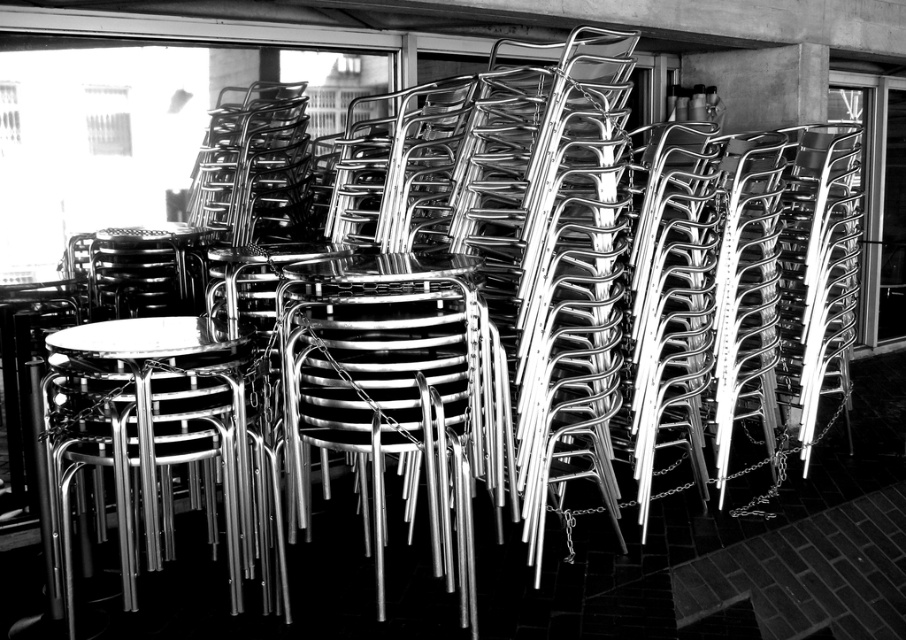
Question: Among these objects, which one is farthest from the camera?

Choices:
 (A) metallic silver chair at center
 (B) polished metal table at center

Answer: (A)

Question: Which point is closer to the camera?

Choices:
 (A) metallic silver chair at center
 (B) polished metal table at center

Answer: (B)

Question: Is metallic silver chair at center smaller than polished metal table at center?

Choices:
 (A) no
 (B) yes

Answer: (A)

Question: Can you confirm if metallic silver chair at center is positioned to the right of polished metal table at center?

Choices:
 (A) no
 (B) yes

Answer: (B)

Question: Is metallic silver chair at center to the left of polished metal table at center from the viewer's perspective?

Choices:
 (A) yes
 (B) no

Answer: (B)